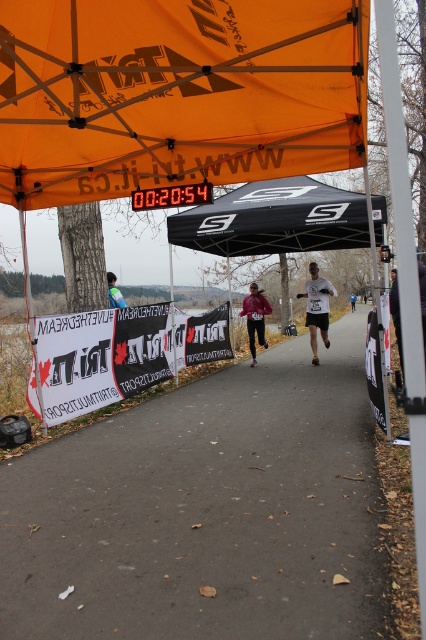
You are a runner in a race and need to decide whether to stay on the gray asphalt road at center or move under the orange fabric canopy at upper center for shade. Based on their sizes, which option provides more coverage area?

The gray asphalt road at center is larger in size than the orange fabric canopy at upper center, so it provides a greater coverage area for shade.

You are a runner participating in the race and you see the gray asphalt road at center and the matte pink jacket at center. Which object is wider?

The gray asphalt road at center is wider than the matte pink jacket at center according to the description.